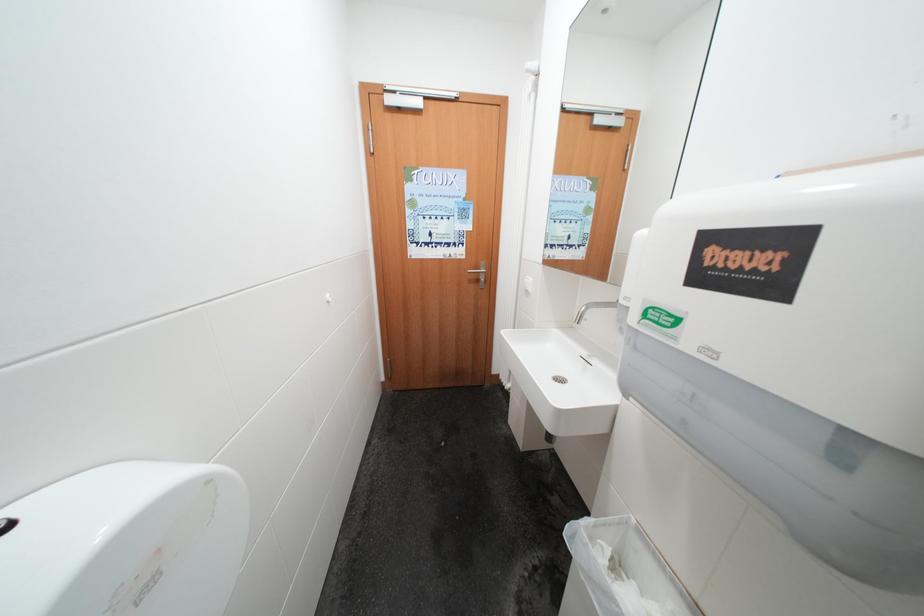
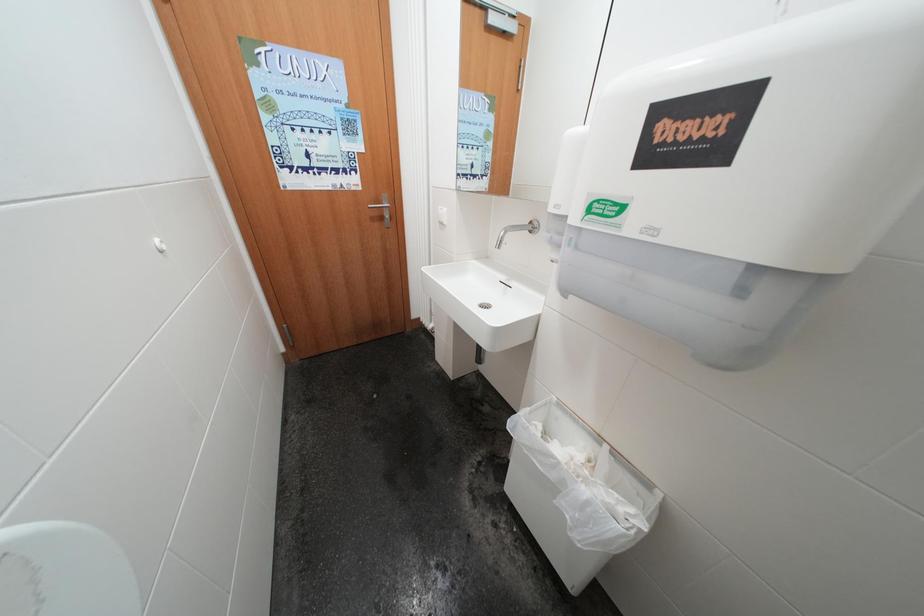
Question: The camera is either moving clockwise (left) or counter-clockwise (right) around the object. The first image is from the beginning of the video and the second image is from the end. Is the camera moving left or right when shooting the video?

Choices:
 (A) Left
 (B) Right

Answer: (A)